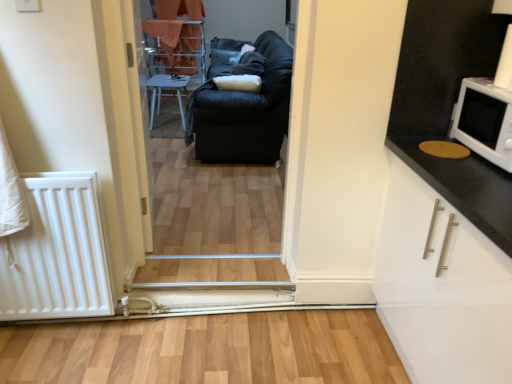
Question: Is black leather couch at center shorter than white glossy microwave at upper right?

Choices:
 (A) yes
 (B) no

Answer: (B)

Question: Is black leather couch at center closer to the viewer compared to white glossy microwave at upper right?

Choices:
 (A) yes
 (B) no

Answer: (B)

Question: Does black leather couch at center appear on the right side of white glossy microwave at upper right?

Choices:
 (A) no
 (B) yes

Answer: (A)

Question: From the image's perspective, does black leather couch at center appear lower than white glossy microwave at upper right?

Choices:
 (A) yes
 (B) no

Answer: (A)

Question: Considering the relative sizes of black leather couch at center and white glossy microwave at upper right in the image provided, is black leather couch at center smaller than white glossy microwave at upper right?

Choices:
 (A) no
 (B) yes

Answer: (A)

Question: Would you say black leather couch at center is inside or outside white glossy microwave at upper right?

Choices:
 (A) outside
 (B) inside

Answer: (A)

Question: Is point (239, 261) closer or farther from the camera than point (498, 147)?

Choices:
 (A) closer
 (B) farther

Answer: (B)

Question: Based on their positions, is black leather couch at center located to the left or right of white glossy microwave at upper right?

Choices:
 (A) right
 (B) left

Answer: (B)

Question: Is black leather couch at center in front of or behind white glossy microwave at upper right in the image?

Choices:
 (A) front
 (B) behind

Answer: (B)

Question: Is white glossy microwave at upper right wider or thinner than white wood door at center?

Choices:
 (A) wide
 (B) thin

Answer: (A)

Question: Is white glossy microwave at upper right in front of or behind white wood door at center in the image?

Choices:
 (A) behind
 (B) front

Answer: (B)

Question: Based on their positions, is white glossy microwave at upper right located to the left or right of white wood door at center?

Choices:
 (A) right
 (B) left

Answer: (A)

Question: Do you think white glossy microwave at upper right is within white wood door at center, or outside of it?

Choices:
 (A) outside
 (B) inside

Answer: (A)

Question: Considering the positions of black leather couch at center and white plastic chair at center in the image, is black leather couch at center wider or thinner than white plastic chair at center?

Choices:
 (A) wide
 (B) thin

Answer: (A)

Question: Do you think black leather couch at center is within white plastic chair at center, or outside of it?

Choices:
 (A) outside
 (B) inside

Answer: (A)